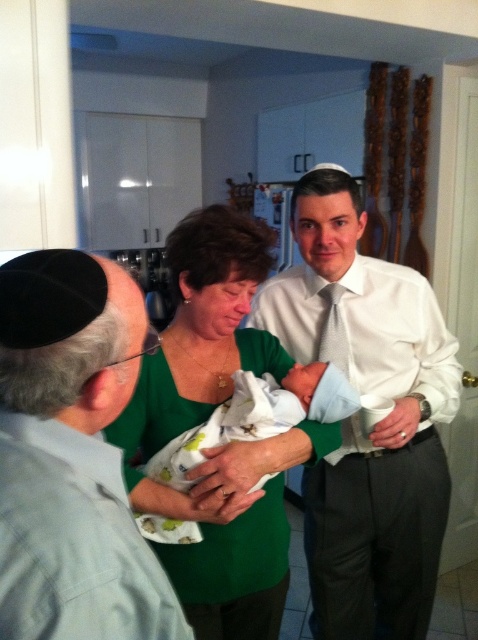
You are a photographer trying to capture a closeup of the white cotton baby at center. The matte green sweater at center is blocking your view. Can you move the sweater to the right to get a better shot?

The matte green sweater at center is positioned on the left side of the white cotton baby at center, so moving it to the right would allow you to see the baby better.

You are a photographer trying to capture a candid shot of the matte green sweater at center and the white cotton baby at center. Since you want to ensure both are in focus, which one should you focus on first considering their positions?

The matte green sweater at center is located below the white cotton baby at center, so you should focus on the white cotton baby at center first as it is closer to the camera.